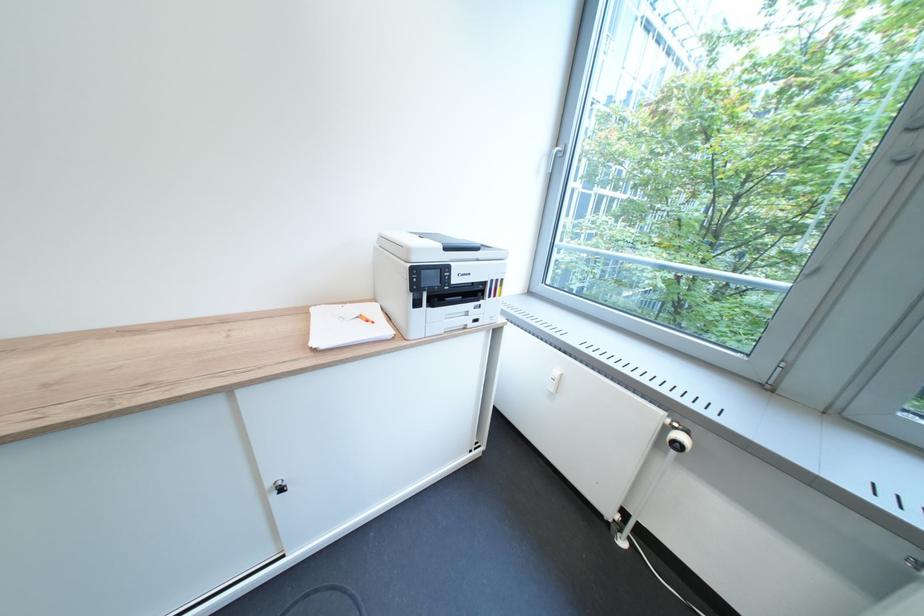
This screenshot has height=616, width=924. I want to click on cabinet door lock, so click(x=280, y=485).